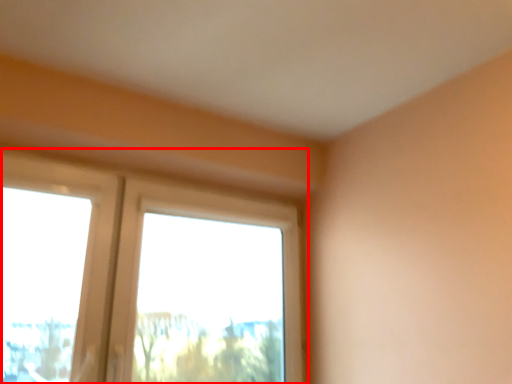
Question: From the image's perspective, where is window (annotated by the red box) located relative to window screen?

Choices:
 (A) below
 (B) above

Answer: (A)